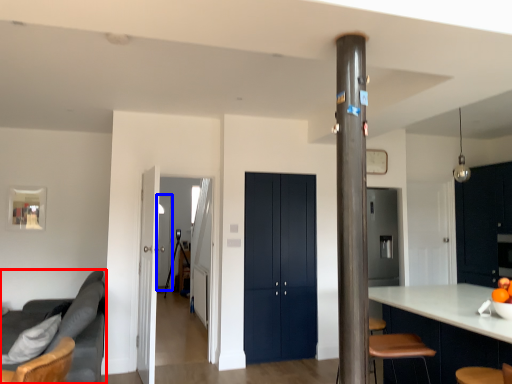
Question: Which object is closer to the camera taking this photo, studio couch (highlighted by a red box) or glass door (highlighted by a blue box)?

Choices:
 (A) studio couch
 (B) glass door

Answer: (A)